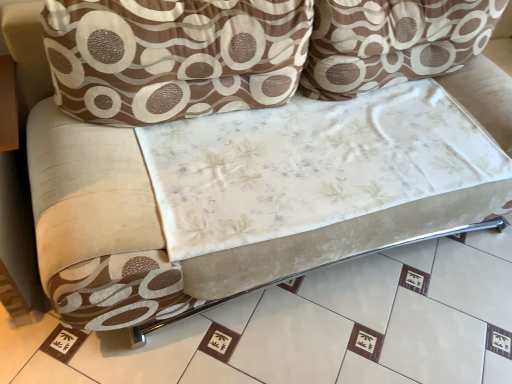
Question: Choose the correct answer: Is white fabric at center inside brown textured pillow at upper center, placed as the second throw pillow when sorted from right to left, or outside it?

Choices:
 (A) outside
 (B) inside

Answer: (A)

Question: Looking at the image, does white fabric at center seem bigger or smaller compared to brown textured pillow at upper center, the first throw pillow in the left-to-right sequence?

Choices:
 (A) big
 (B) small

Answer: (A)

Question: Which is farther from the brown textured pillow at upper center, the 2th throw pillow viewed from the left?

Choices:
 (A) white fabric at center
 (B) brown textured pillow at upper center, placed as the second throw pillow when sorted from right to left

Answer: (A)

Question: Estimate the real-world distances between objects in this image. Which object is closer to the brown textured pillow at upper center, the first throw pillow in the left-to-right sequence?

Choices:
 (A) white fabric at center
 (B) brown textured pillow at upper center, the 2th throw pillow viewed from the left

Answer: (B)